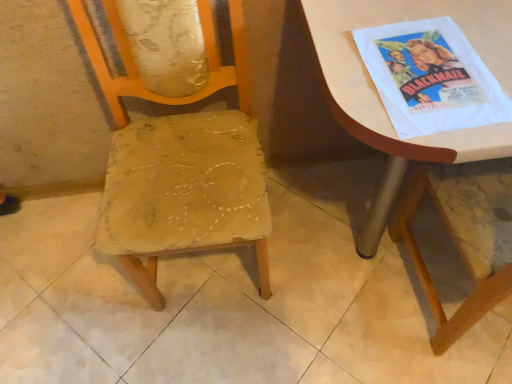
Image resolution: width=512 pixels, height=384 pixels. Identify the location of white paper poster at upper right. (431, 77).

Where is `worn fabric chair at center`? The height and width of the screenshot is (384, 512). worn fabric chair at center is located at coordinates (202, 228).

Measure the distance between point (x=382, y=134) and camera.

Point (x=382, y=134) and camera are 27.60 inches apart.

Locate an element on the screen. The height and width of the screenshot is (384, 512). white paper poster at upper right is located at coordinates (431, 77).

Between worn fabric chair at center and white glossy table at upper right, which one has smaller size?

Smaller between the two is worn fabric chair at center.

Considering the sizes of objects worn fabric chair at center and white glossy table at upper right in the image provided, who is taller, worn fabric chair at center or white glossy table at upper right?

Standing taller between the two is worn fabric chair at center.

Is worn fabric chair at center turned away from white glossy table at upper right?

That's not correct — worn fabric chair at center is not looking away from white glossy table at upper right.

Looking at their sizes, would you say worn fabric chair at center is wider or thinner than white glossy table at upper right?

worn fabric chair at center is thinner than white glossy table at upper right.

Is white paper poster at upper right outside of white glossy table at upper right?

That's incorrect, white paper poster at upper right is not completely outside white glossy table at upper right.

Which of these two, white paper poster at upper right or white glossy table at upper right, is thinner?

white paper poster at upper right is thinner.

Find the location of `comic book that appears on the left of white glossy table at upper right`. comic book that appears on the left of white glossy table at upper right is located at coordinates (431, 77).

Which is correct: white glossy table at upper right is inside white paper poster at upper right, or outside of it?

white glossy table at upper right is not enclosed by white paper poster at upper right.

Based on the photo, which object is further away from the camera, white glossy table at upper right or white paper poster at upper right?

white paper poster at upper right is further from the camera.

Is point (330, 57) more distant than point (366, 30)?

No, it is not.

Which object is wider, white glossy table at upper right or white paper poster at upper right?

white glossy table at upper right.

From a real-world perspective, is white glossy table at upper right located beneath worn fabric chair at center?

Yes, from a real-world perspective, white glossy table at upper right is beneath worn fabric chair at center.

Is white glossy table at upper right touching worn fabric chair at center?

No, white glossy table at upper right is not with worn fabric chair at center.

Choose the correct answer: Is white glossy table at upper right inside worn fabric chair at center or outside it?

white glossy table at upper right exists outside the volume of worn fabric chair at center.

Considering the relative sizes of white glossy table at upper right and worn fabric chair at center in the image provided, is white glossy table at upper right smaller than worn fabric chair at center?

Actually, white glossy table at upper right might be larger than worn fabric chair at center.

Is worn fabric chair at center positioned with its back to white paper poster at upper right?

No.

Between worn fabric chair at center and white paper poster at upper right, which one has less height?

white paper poster at upper right is shorter.

Which object is further away from the camera taking this photo, worn fabric chair at center or white paper poster at upper right?

white paper poster at upper right is behind.

Is white paper poster at upper right positioned beyond the bounds of worn fabric chair at center?

Absolutely, white paper poster at upper right is external to worn fabric chair at center.

Is white paper poster at upper right oriented towards worn fabric chair at center?

No, white paper poster at upper right is not facing towards worn fabric chair at center.

Is white paper poster at upper right closer to the viewer compared to worn fabric chair at center?

No, it is behind worn fabric chair at center.

From a real-world perspective, is white paper poster at upper right physically below worn fabric chair at center?

Incorrect, from a real-world perspective, white paper poster at upper right is higher than worn fabric chair at center.

Locate an element on the screen. Image resolution: width=512 pixels, height=384 pixels. table that is on the right side of worn fabric chair at center is located at coordinates (414, 138).

I want to click on comic book lying on the left of white glossy table at upper right, so click(x=431, y=77).

Which object lies further to the anchor point white paper poster at upper right, white glossy table at upper right or worn fabric chair at center?

Based on the image, worn fabric chair at center appears to be further to white paper poster at upper right.

Looking at the image, which one is located further to worn fabric chair at center, white glossy table at upper right or white paper poster at upper right?

Among the two, white glossy table at upper right is located further to worn fabric chair at center.

From the image, which object appears to be farther from white glossy table at upper right, white paper poster at upper right or worn fabric chair at center?

Based on the image, worn fabric chair at center appears to be further to white glossy table at upper right.

From the image, which object appears to be nearer to white glossy table at upper right, worn fabric chair at center or white paper poster at upper right?

Among the two, white paper poster at upper right is located nearer to white glossy table at upper right.

Looking at this image, which object lies nearer to the anchor point worn fabric chair at center, white paper poster at upper right or white glossy table at upper right?

white paper poster at upper right is positioned closer to the anchor worn fabric chair at center.

Estimate the real-world distances between objects in this image. Which object is further from white paper poster at upper right, worn fabric chair at center or white glossy table at upper right?

Among the two, worn fabric chair at center is located further to white paper poster at upper right.

You are a GUI agent. You are given a task and a screenshot of the screen. Output one action in this format:
    pyautogui.click(x=<x>, y=<y>)
    Task: Click on the comic book located between worn fabric chair at center and white glossy table at upper right in the left-right direction
    The image size is (512, 384).
    Given the screenshot: What is the action you would take?
    pyautogui.click(x=431, y=77)